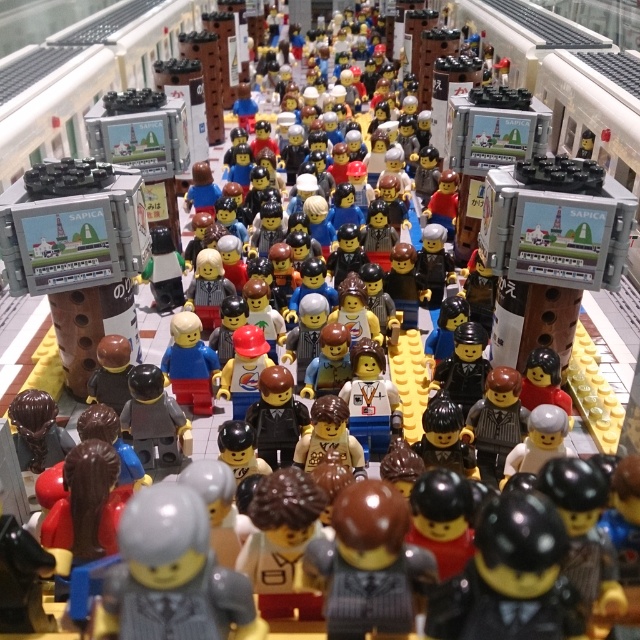
Does white matte minifigure at center appear under matte black suit at center?

No, white matte minifigure at center is not below matte black suit at center.

Can you confirm if white matte minifigure at center is smaller than matte black suit at center?

Indeed, white matte minifigure at center has a smaller size compared to matte black suit at center.

Is point (381, 413) behind point (280, 460)?

Yes.

Locate an element on the screen. The height and width of the screenshot is (640, 640). white matte minifigure at center is located at coordinates (371, 397).

Does white matte minifigure at center appear over matte plastic figure at center?

Incorrect, white matte minifigure at center is not positioned above matte plastic figure at center.

In the scene shown: Is white matte minifigure at center closer to camera compared to matte plastic figure at center?

Yes, white matte minifigure at center is in front of matte plastic figure at center.

What do you see at coordinates (371, 397) in the screenshot? I see `white matte minifigure at center` at bounding box center [371, 397].

Where is `white matte minifigure at center`? white matte minifigure at center is located at coordinates (371, 397).

Which is behind, point (120, 525) or point (369, 448)?

Positioned behind is point (369, 448).

Image resolution: width=640 pixels, height=640 pixels. Describe the element at coordinates (172, 576) in the screenshot. I see `matte gray suit at center` at that location.

Is point (125, 548) farther from viewer compared to point (362, 376)?

No, (125, 548) is in front of (362, 376).

Where is `matte gray suit at center`? matte gray suit at center is located at coordinates coord(172,576).